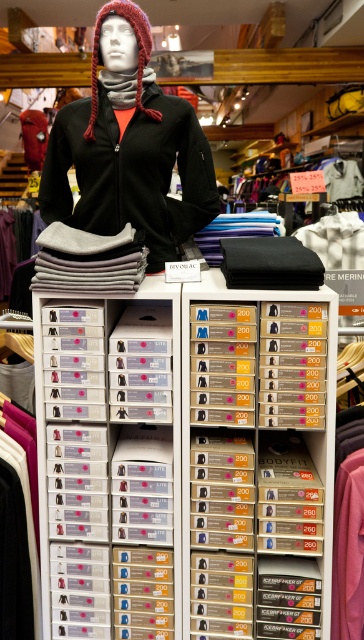
What do you see at coordinates (183, 461) in the screenshot?
I see `clear plastic boxes at center` at bounding box center [183, 461].

Which is more to the left, clear plastic boxes at center or pink fabric at lower right?

From the viewer's perspective, clear plastic boxes at center appears more on the left side.

Who is more distant from viewer, (99, 333) or (358, 584)?

The point (99, 333) is more distant.

Locate an element on the screen. clear plastic boxes at center is located at coordinates (183, 461).

Does matte black jacket at center have a lesser height compared to pink fabric at lower right?

No, matte black jacket at center is not shorter than pink fabric at lower right.

Is matte black jacket at center positioned before pink fabric at lower right?

No, matte black jacket at center is behind pink fabric at lower right.

I want to click on matte black jacket at center, so click(131, 172).

Between clear plastic boxes at center and clear plastic drawer at center, which one is positioned higher?

clear plastic boxes at center is above.

How far apart are clear plastic boxes at center and clear plastic drawer at center?

They are 6.79 centimeters apart.

Where is `clear plastic boxes at center`? This screenshot has width=364, height=640. clear plastic boxes at center is located at coordinates (183, 461).